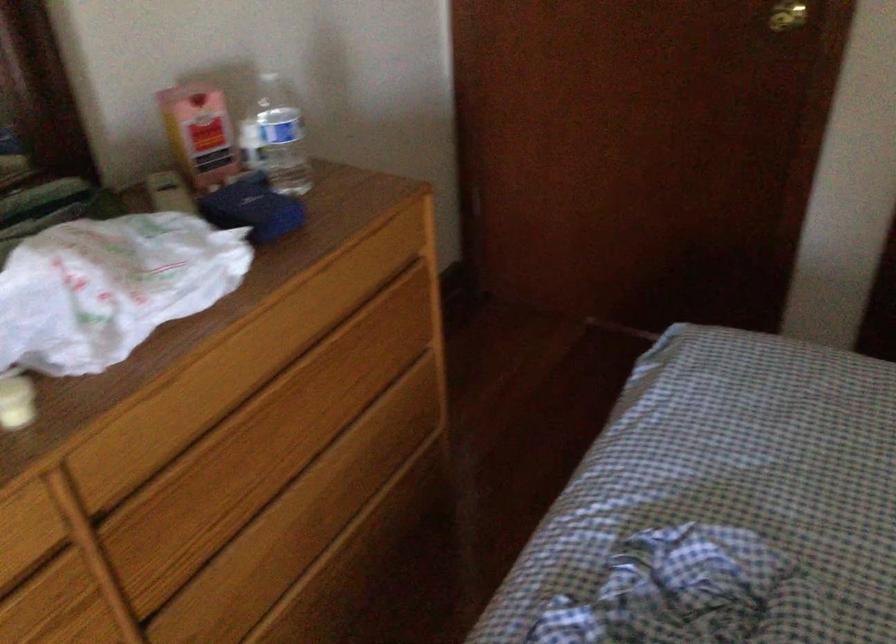
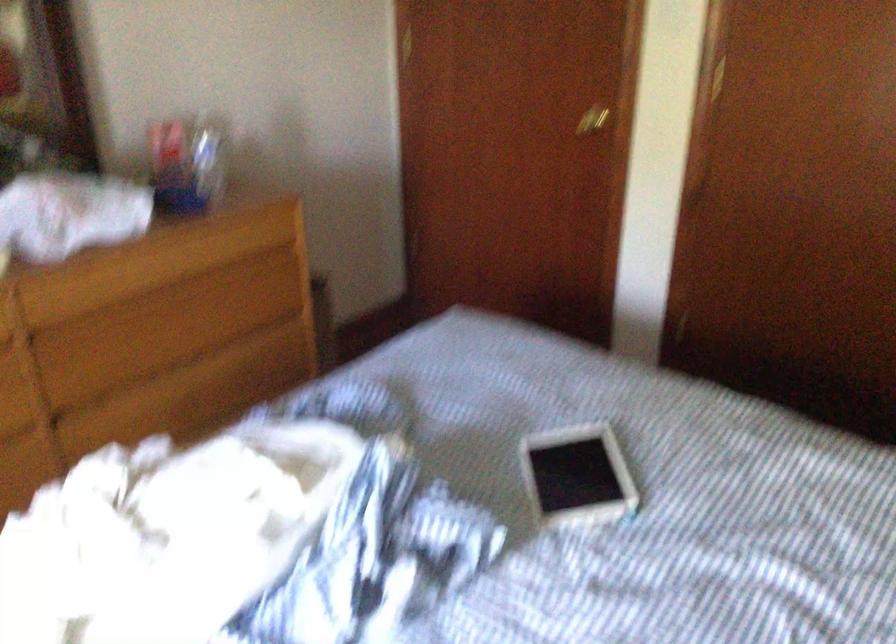
Question: I am providing you with two images of the same scene from different viewpoints. Please identify which objects are invisible in image2.

Choices:
 (A) plastic bottle
 (B) gold door handle
 (C) white tablet
 (D) none of these

Answer: (D)